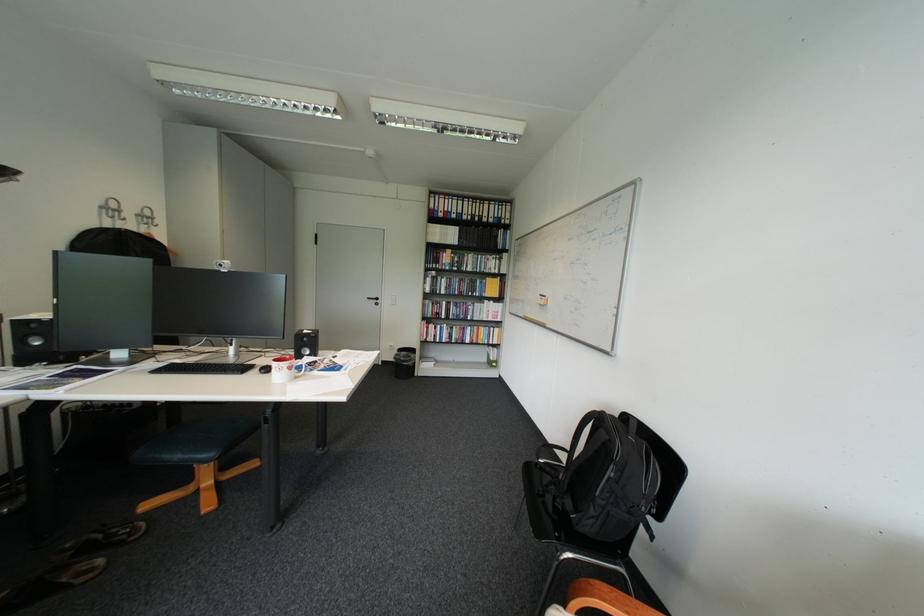
Where would you lift the black chair armrest? Please return your answer as a coordinate pair (x, y).

(551, 451)